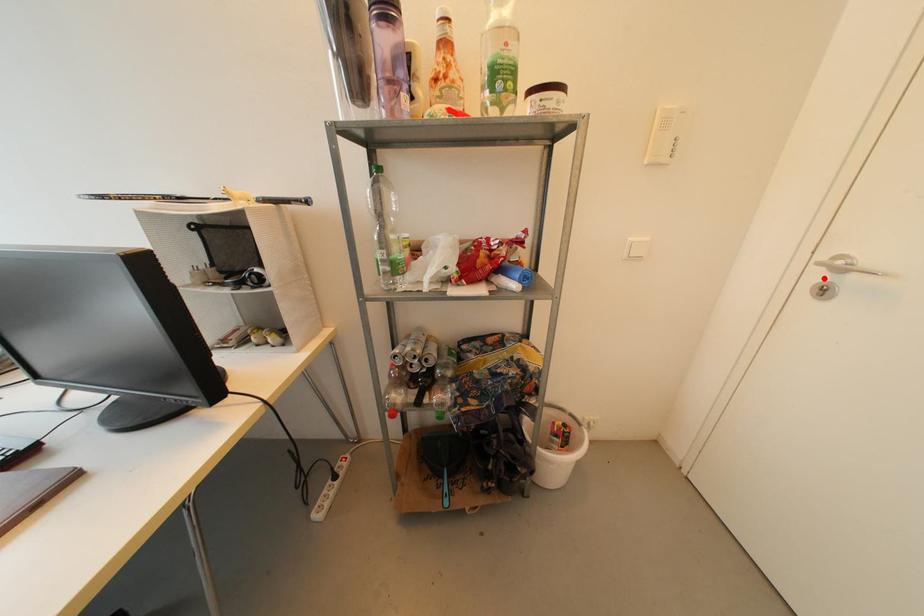
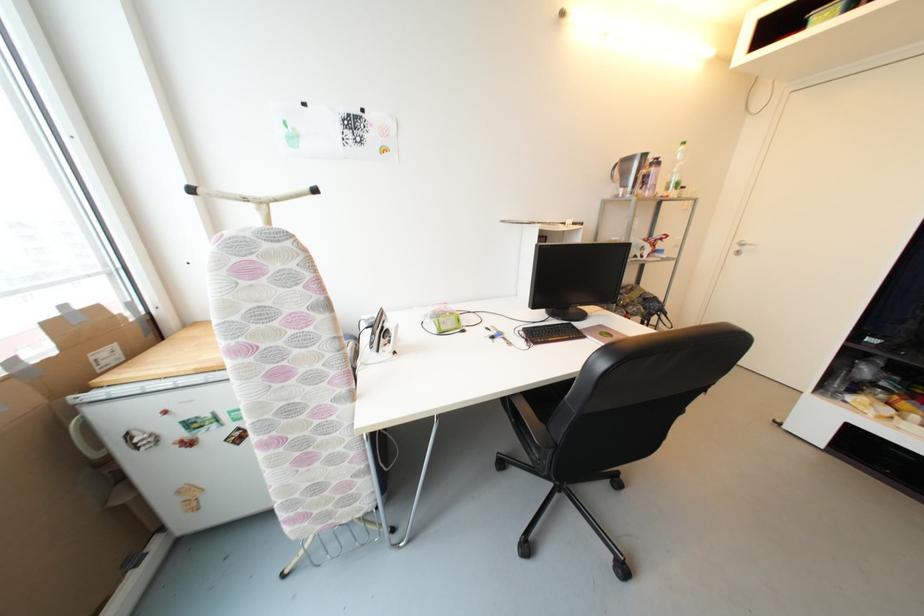
The point at the highlighted location is marked in the first image. Where is the corresponding point in the second image?

(742, 249)